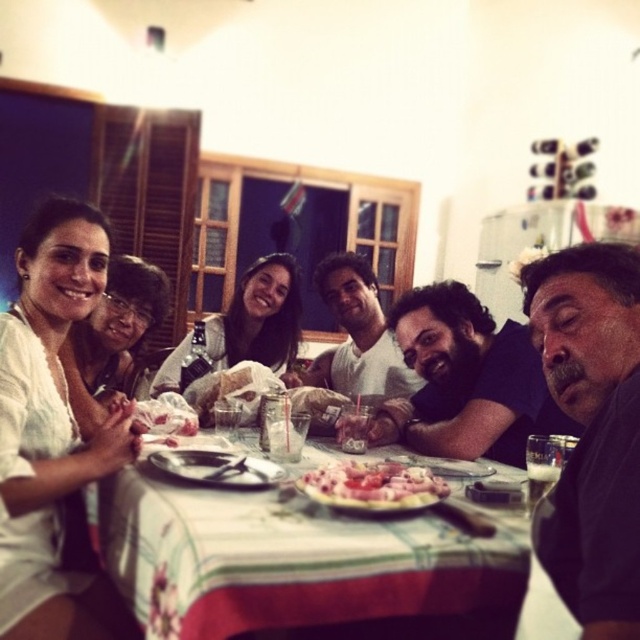
Does dark gray shirt at right appear over smooth white shirt at center?

Actually, dark gray shirt at right is below smooth white shirt at center.

Who is more distant from viewer, (582, 570) or (356, 353)?

The point (356, 353) is behind.

Which is in front, point (605, 550) or point (326, 298)?

Point (605, 550) is more forward.

You are a GUI agent. You are given a task and a screenshot of the screen. Output one action in this format:
    pyautogui.click(x=<x>, y=<y>)
    Task: Click on the dark gray shirt at right
    
    Given the screenshot: What is the action you would take?
    pyautogui.click(x=592, y=429)

Is white cotton shirt at upper left above dark brown hair at center?

Actually, white cotton shirt at upper left is below dark brown hair at center.

Can you confirm if white cotton shirt at upper left is positioned below dark brown hair at center?

Correct, white cotton shirt at upper left is located below dark brown hair at center.

Between point (36, 285) and point (394, 310), which one is positioned behind?

Positioned behind is point (394, 310).

At what (x,y) coordinates should I click in order to perform the action: click on white cotton shirt at upper left. Please return your answer as a coordinate pair (x, y). This screenshot has height=640, width=640. Looking at the image, I should click on (52, 435).

Is dark gray shirt at right above dark brown hair at center?

Indeed, dark gray shirt at right is positioned over dark brown hair at center.

Consider the image. Is dark gray shirt at right bigger than dark brown hair at center?

No.

Is point (589, 628) farther from camera compared to point (444, 294)?

That is False.

Identify the location of dark gray shirt at right. The image size is (640, 640). (592, 429).